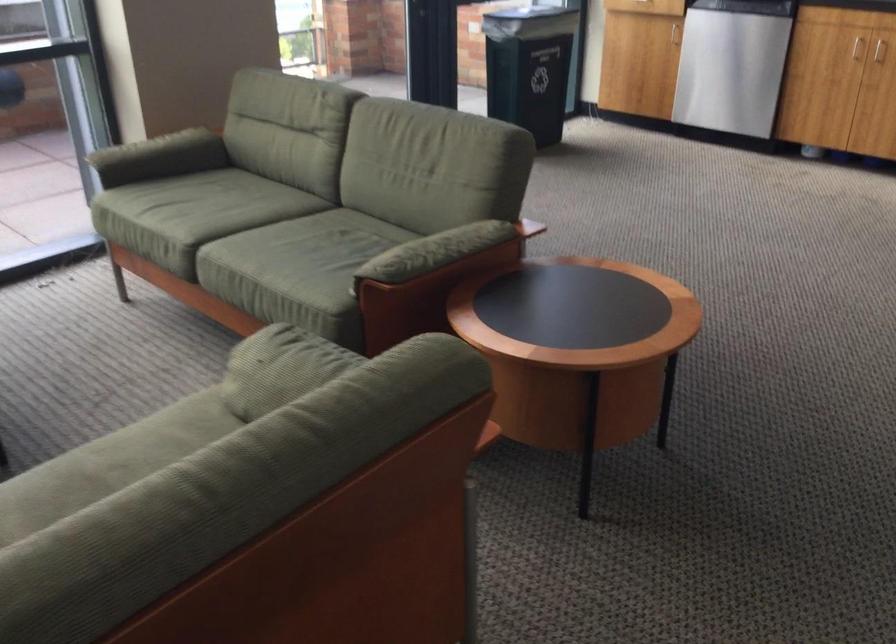
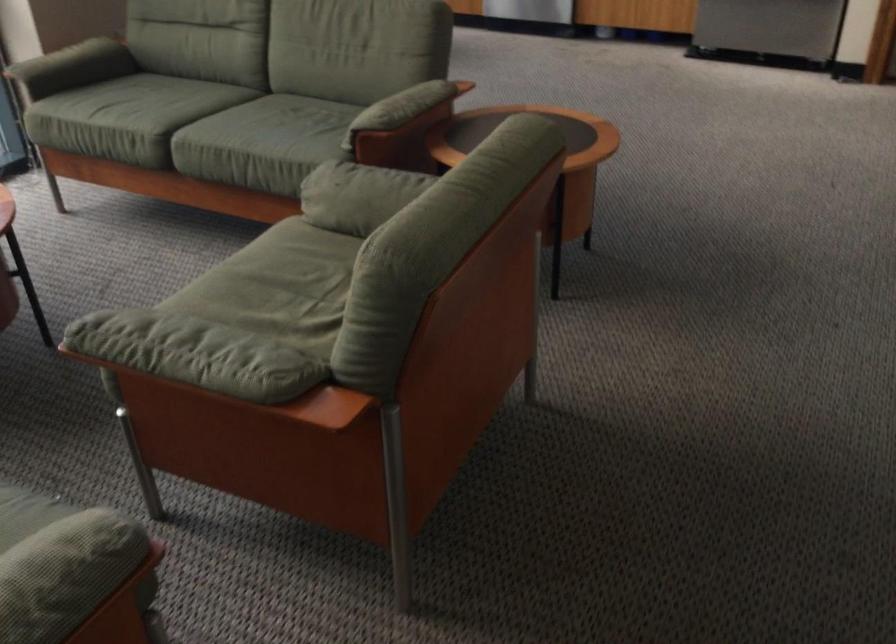
Where in the second image is the point corresponding to point 297,354 from the first image?

(364, 176)